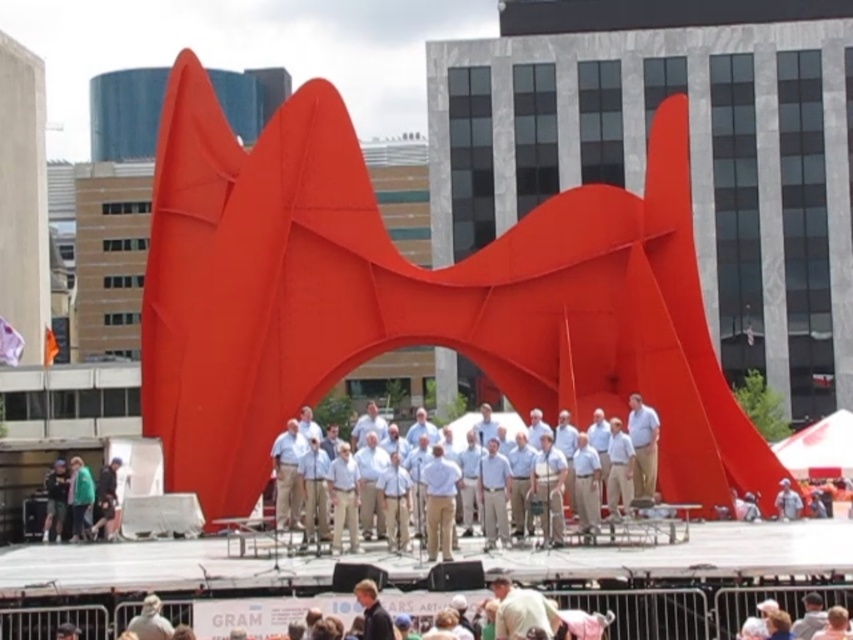
Consider the image. Which is below, light brown leather jacket at lower center or tan fabric shirt at center?

Positioned lower is light brown leather jacket at lower center.

Is light brown leather jacket at lower center smaller than tan fabric shirt at center?

Yes.

Identify the location of light brown leather jacket at lower center. This screenshot has width=853, height=640. (521, 611).

Is light blue shirt at center below light brown leather jacket at lower center?

Actually, light blue shirt at center is above light brown leather jacket at lower center.

Image resolution: width=853 pixels, height=640 pixels. What do you see at coordinates (625, 451) in the screenshot?
I see `light blue shirt at center` at bounding box center [625, 451].

At what (x,y) coordinates should I click in order to perform the action: click on light blue shirt at center. Please return your answer as a coordinate pair (x, y). The width and height of the screenshot is (853, 640). Looking at the image, I should click on (625, 451).

You are a GUI agent. You are given a task and a screenshot of the screen. Output one action in this format:
    pyautogui.click(x=<x>, y=<y>)
    Task: Click on the light blue shirt at center
    The height and width of the screenshot is (640, 853).
    Given the screenshot: What is the action you would take?
    (625, 451)

Who is more distant from viewer, (265, 460) or (560, 442)?

The point (265, 460) is more distant.

From the picture: Who is positioned more to the right, matte red sculpture at center or light blue shirt at center?

From the viewer's perspective, light blue shirt at center appears more on the right side.

Between point (347, 282) and point (631, 493), which one is positioned behind?

Positioned behind is point (347, 282).

Locate an element on the screen. matte red sculpture at center is located at coordinates (412, 298).